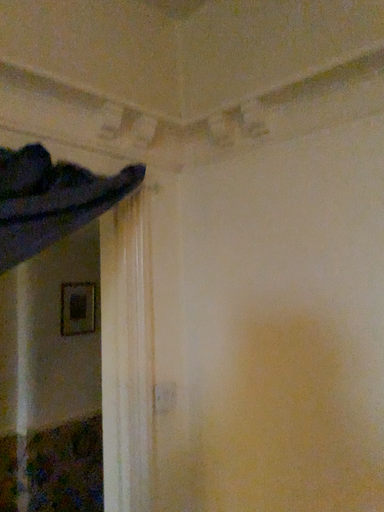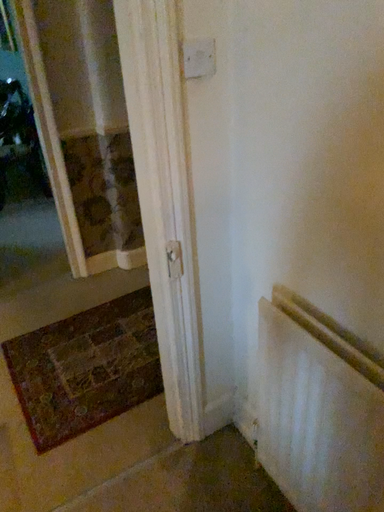
Question: How did the camera likely rotate when shooting the video?

Choices:
 (A) rotated left
 (B) rotated right

Answer: (A)